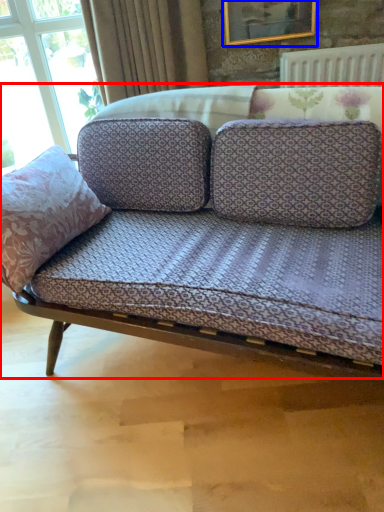
Question: Among these objects, which one is farthest to the camera, studio couch (highlighted by a red box) or picture frame (highlighted by a blue box)?

Choices:
 (A) studio couch
 (B) picture frame

Answer: (B)